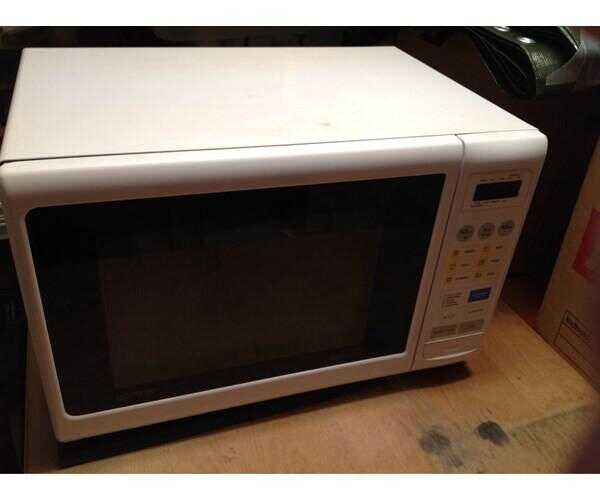
Where is `1 bottom button on microwave`? The image size is (600, 500). 1 bottom button on microwave is located at coordinates (457, 344).